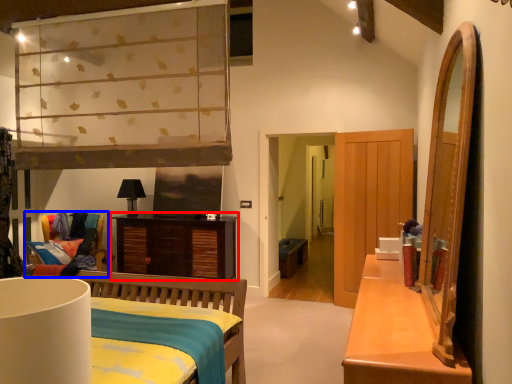
Question: Which point is further to the camera, cabinetry (highlighted by a red box) or chair (highlighted by a blue box)?

Choices:
 (A) cabinetry
 (B) chair

Answer: (A)